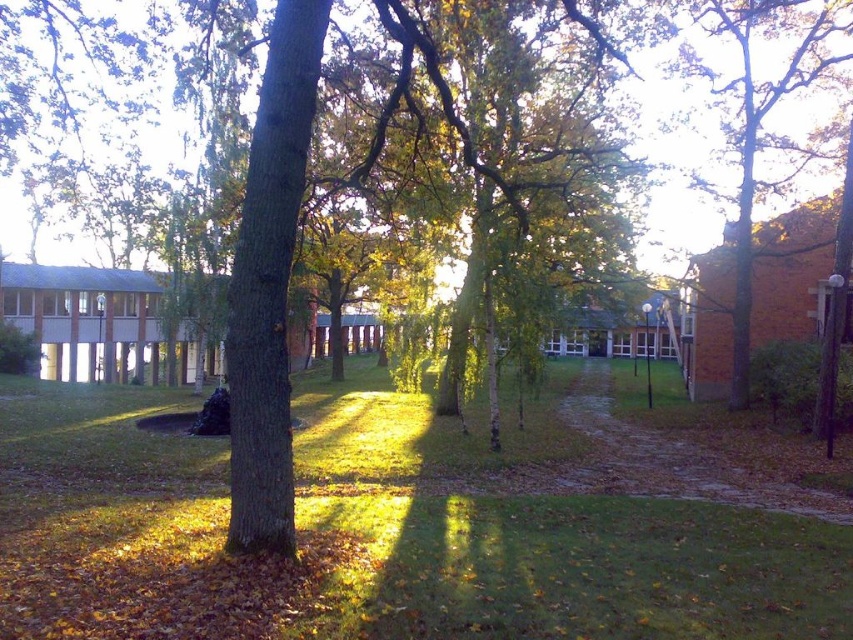
Is green grass at center below brown textured tree at right?

Yes.

Does point (132, 483) come in front of point (822, 33)?

Yes.

Image resolution: width=853 pixels, height=640 pixels. I want to click on green grass at center, so click(405, 525).